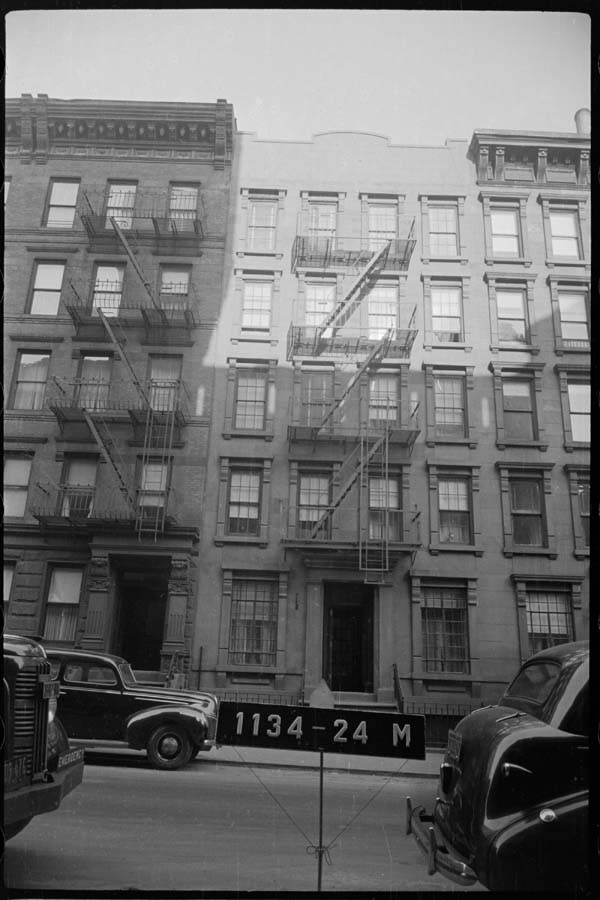
The width and height of the screenshot is (600, 900). In order to click on door in this screenshot , I will do `click(345, 653)`.